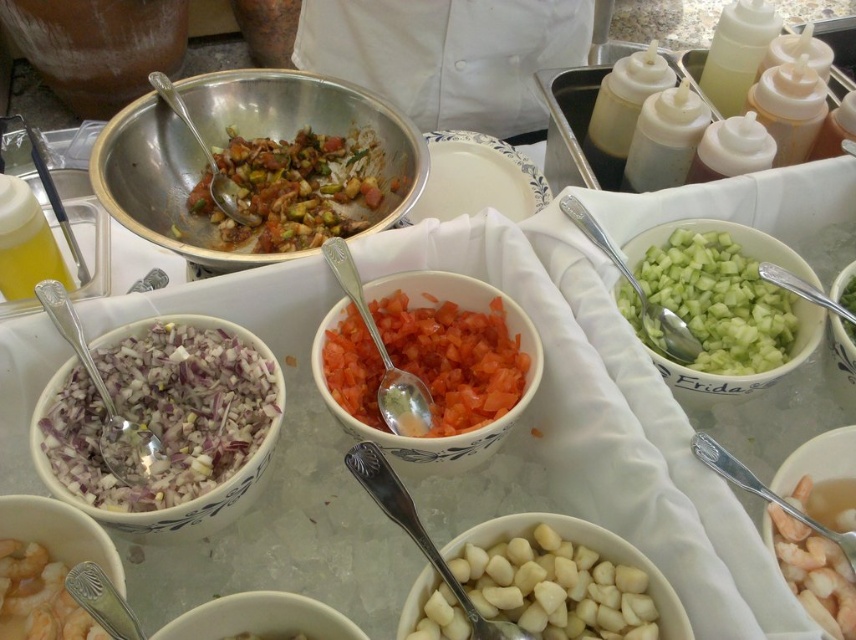
You are setting up a food station and need to determine which container to use for a taller item. Looking at the stainless steel bowl at center and the green leafy vegetable at center, which one is taller?

The stainless steel bowl at center is much taller than the green leafy vegetable at center, so it is the taller item.